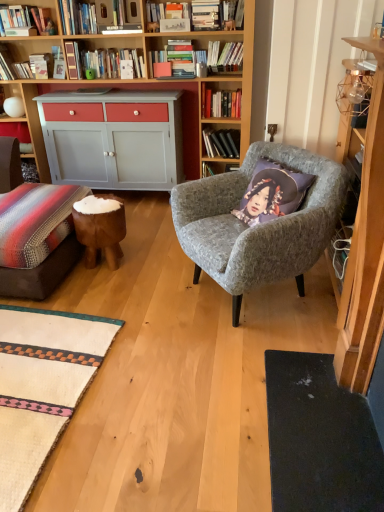
Question: Could you tell me if textured gray armchair at center is turned towards wooden bookshelf at upper left, which is the second shelf from bottom to top?

Choices:
 (A) yes
 (B) no

Answer: (B)

Question: Can you confirm if textured gray armchair at center is shorter than wooden bookshelf at upper left, the 1th shelf in the top-to-bottom sequence?

Choices:
 (A) yes
 (B) no

Answer: (B)

Question: Is textured gray armchair at center placed right next to wooden bookshelf at upper left, arranged as the first shelf when viewed from the front?

Choices:
 (A) no
 (B) yes

Answer: (A)

Question: Is textured gray armchair at center facing away from wooden bookshelf at upper left, arranged as the second shelf when viewed from the back?

Choices:
 (A) no
 (B) yes

Answer: (A)

Question: Is textured gray armchair at center not close to wooden bookshelf at upper left, arranged as the first shelf when viewed from the front?

Choices:
 (A) yes
 (B) no

Answer: (A)

Question: Is wooden bookshelf at upper left, the 1th shelf in the top-to-bottom sequence, completely or partially inside textured gray armchair at center?

Choices:
 (A) no
 (B) yes

Answer: (A)

Question: Is brown wooden stool at lower left oriented towards matte gray cabinet at left, which is counted as the 2th shelf, starting from the front?

Choices:
 (A) no
 (B) yes

Answer: (A)

Question: Is brown wooden stool at lower left not inside matte gray cabinet at left, which is counted as the 2th shelf, starting from the front?

Choices:
 (A) yes
 (B) no

Answer: (A)

Question: Is brown wooden stool at lower left smaller than matte gray cabinet at left, the 1th shelf when ordered from bottom to top?

Choices:
 (A) yes
 (B) no

Answer: (B)

Question: Is brown wooden stool at lower left closer to camera compared to matte gray cabinet at left, the 1th shelf when ordered from bottom to top?

Choices:
 (A) no
 (B) yes

Answer: (B)

Question: Would you say brown wooden stool at lower left is a long distance from matte gray cabinet at left, positioned as the 2th shelf in top-to-bottom order?

Choices:
 (A) no
 (B) yes

Answer: (B)

Question: Can you confirm if brown wooden stool at lower left is shorter than matte gray cabinet at left, the 1th shelf when ordered from bottom to top?

Choices:
 (A) yes
 (B) no

Answer: (B)

Question: Are hardcover books at upper center, which ranks as the second book in bottom-to-top order, and wooden bookshelf at upper left, the 1th shelf in the top-to-bottom sequence, located far from each other?

Choices:
 (A) no
 (B) yes

Answer: (B)